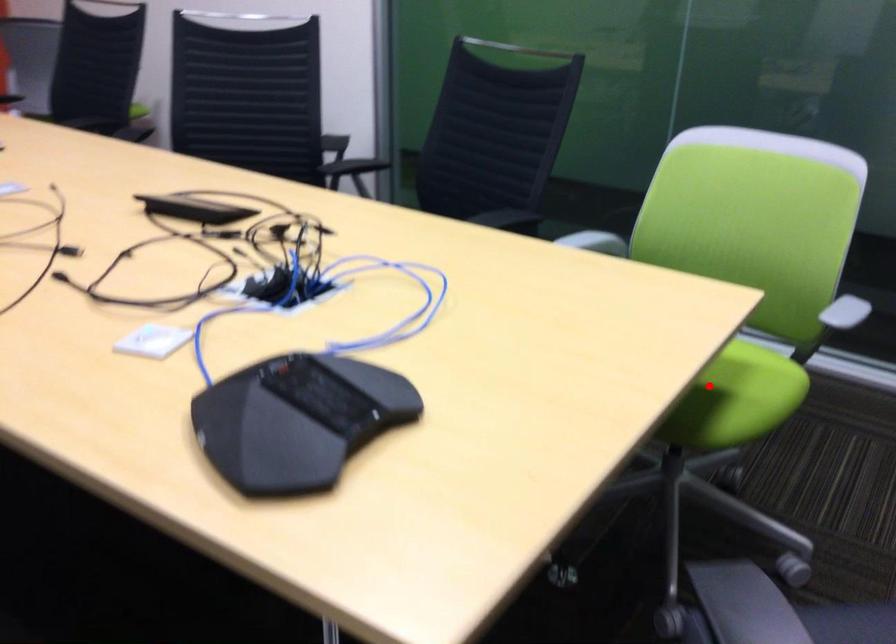
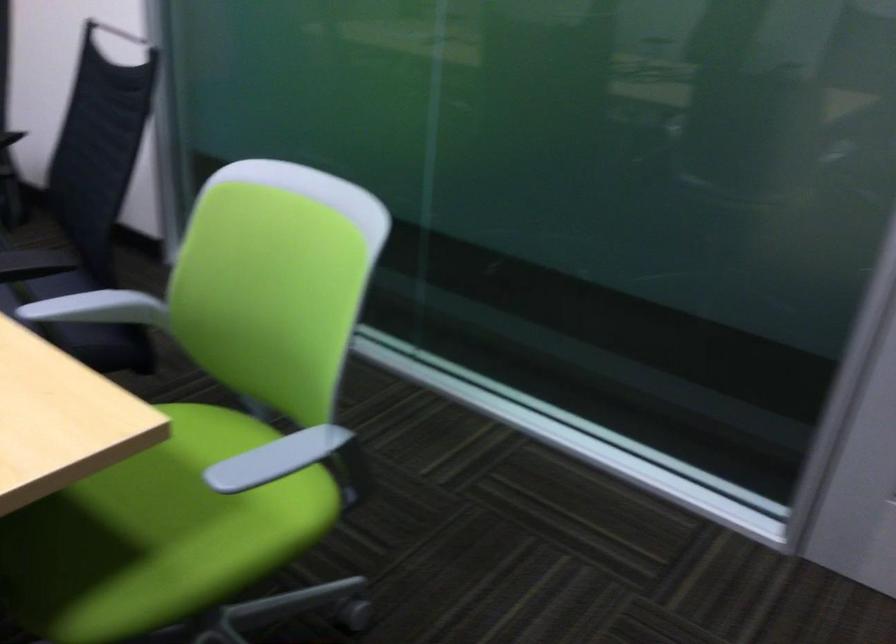
Question: I am providing you with two images of the same scene from different viewpoints. In image1, a red point is highlighted. Considering the same 3D point in image2, which of the following is correct?

Choices:
 (A) It is closer
 (B) It is farther

Answer: (A)